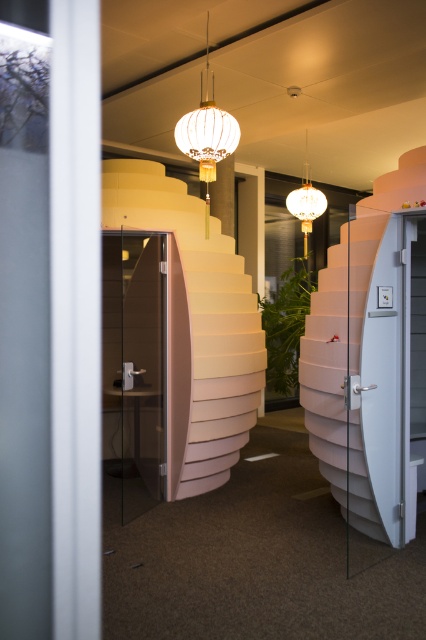
Question: Is transparent glass door at left to the left of matte white globe at upper center from the viewer's perspective?

Choices:
 (A) yes
 (B) no

Answer: (A)

Question: Based on their relative distances, which object is nearer to the transparent glass door at left?

Choices:
 (A) matte white globe at upper center
 (B) matte pink stairs at center

Answer: (B)

Question: Among these points, which one is nearest to the camera?

Choices:
 (A) (227, 374)
 (B) (109, 408)

Answer: (A)

Question: Observing the image, what is the correct spatial positioning of transparent glass door at left in reference to matte white globe at upper center?

Choices:
 (A) above
 (B) below

Answer: (B)

Question: Where is matte pink stairs at center located in relation to transparent glass door at left in the image?

Choices:
 (A) below
 (B) above

Answer: (B)

Question: Which is nearer to the transparent glass door at left?

Choices:
 (A) matte white globe at upper center
 (B) matte pink stairs at center

Answer: (B)